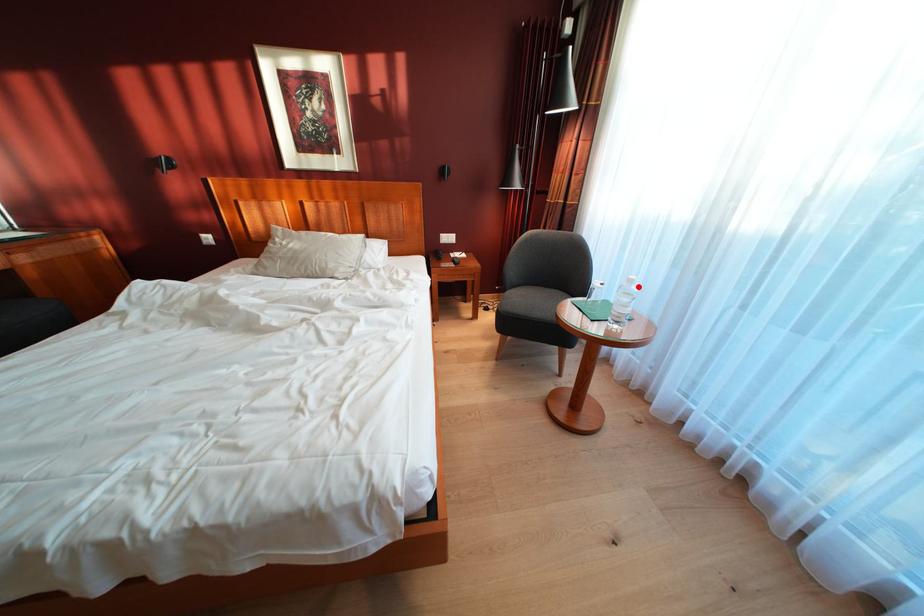
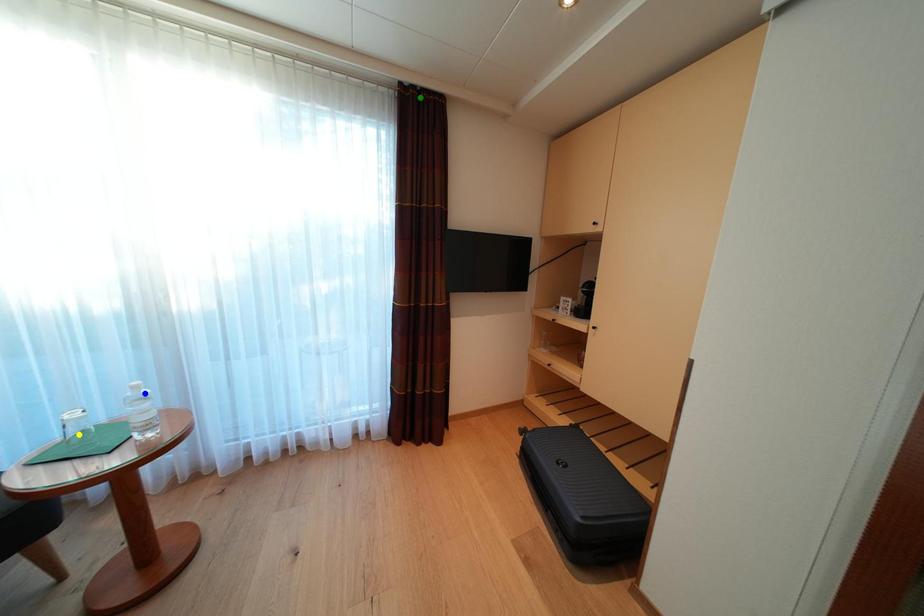
Question: I am providing you with two images of the same scene from different viewpoints. A red point is marked on the first image. You are given multiple points on the second image. Which mark in image 2 goes with the point in image 1?

Choices:
 (A) green point
 (B) blue point
 (C) yellow point

Answer: (B)